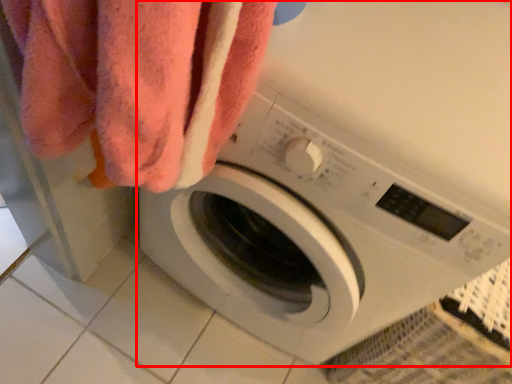
Question: From the image's perspective, where is washing machine (annotated by the red box) located relative to towel?

Choices:
 (A) below
 (B) above

Answer: (B)